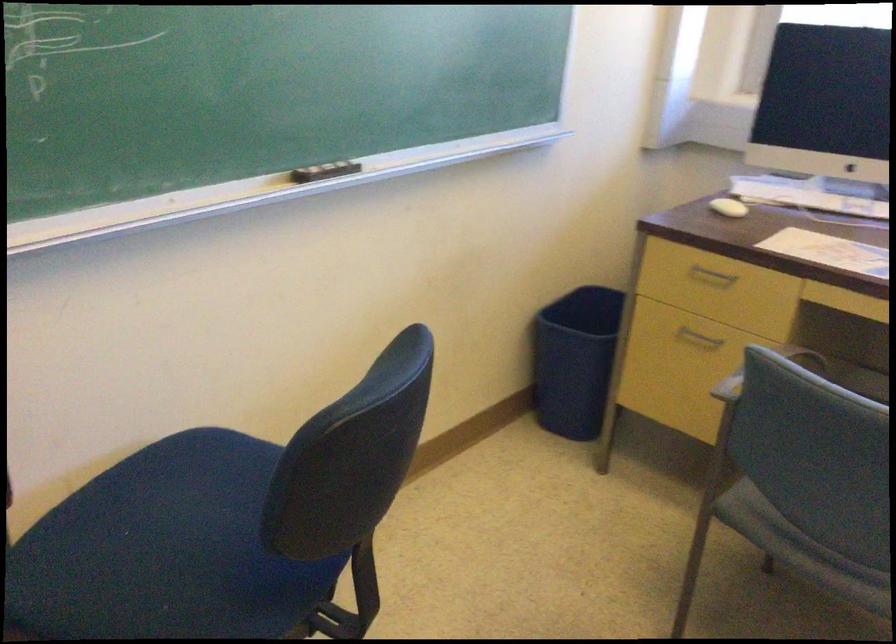
Where would you wip the black chalkboard eraser? Please return your answer as a coordinate pair (x, y).

(324, 171)